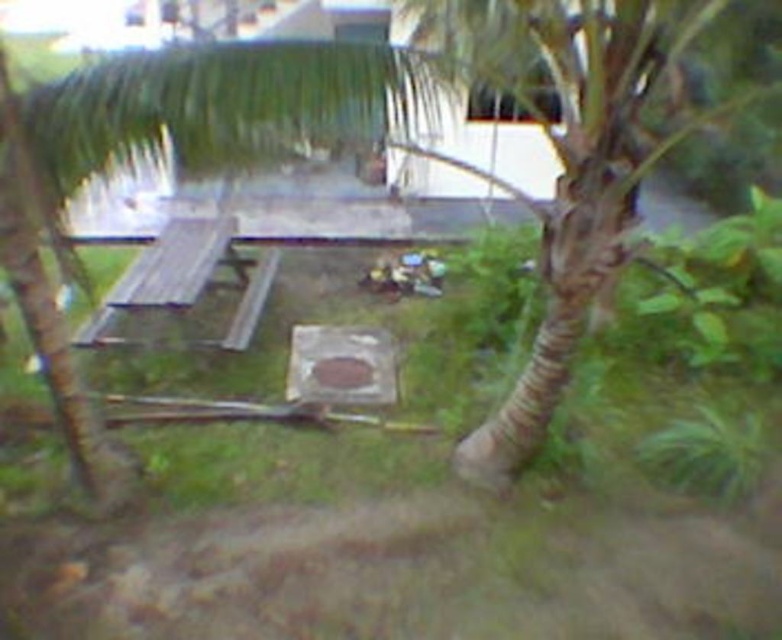
Between point (113, 360) and point (106, 301), which one is positioned in front?

Point (106, 301) is more forward.

Identify the location of green grass at center. (336, 323).

Who is more distant from viewer, [174,472] or [144,272]?

The point [144,272] is behind.

This screenshot has width=782, height=640. I want to click on green grass at center, so click(336, 323).